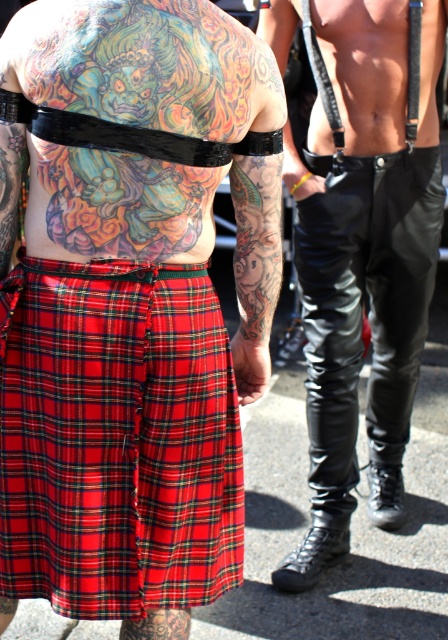
Question: Which is farther from the red plaid kilt at lower left?

Choices:
 (A) black leather pants at center
 (B) red plaid kilt at center

Answer: (A)

Question: Which point is farther to the camera?

Choices:
 (A) red plaid kilt at center
 (B) black leather pants at center
 (C) red plaid kilt at lower left

Answer: (B)

Question: Where is red plaid kilt at center located in relation to red plaid kilt at lower left in the image?

Choices:
 (A) right
 (B) left

Answer: (A)

Question: Which of the following is the farthest from the observer?

Choices:
 (A) black leather pants at center
 (B) red plaid kilt at lower left
 (C) red plaid kilt at center

Answer: (A)

Question: Observing the image, what is the correct spatial positioning of red plaid kilt at lower left in reference to black leather pants at center?

Choices:
 (A) left
 (B) right

Answer: (A)

Question: Is red plaid kilt at center thinner than red plaid kilt at lower left?

Choices:
 (A) yes
 (B) no

Answer: (B)